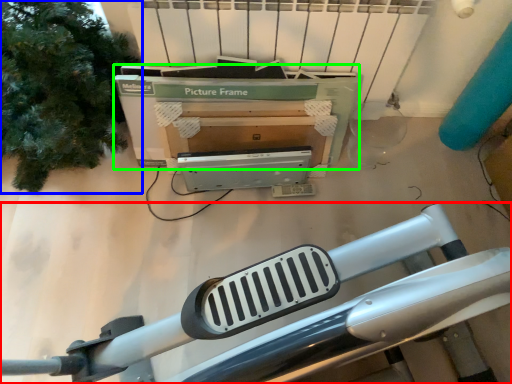
Question: Estimate the real-world distances between objects in this image. Which object is farther from furniture (highlighted by a red box), tree (highlighted by a blue box) or box (highlighted by a green box)?

Choices:
 (A) tree
 (B) box

Answer: (A)